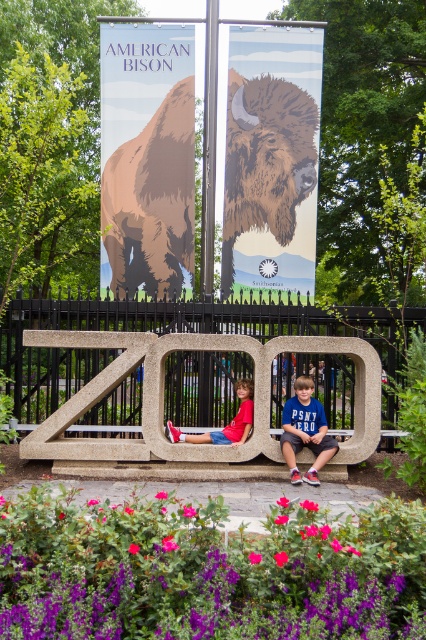
Who is more distant from viewer, (x=144, y=390) or (x=296, y=97)?

The point (x=296, y=97) is behind.

Between point (161, 394) and point (282, 188), which one is positioned in front?

Positioned in front is point (161, 394).

This screenshot has width=426, height=640. In order to click on granite bench at center in this screenshot , I will do pos(163,410).

Who is positioned more to the left, brown textured bison at center or blue cotton shirt at center?

From the viewer's perspective, brown textured bison at center appears more on the left side.

Does brown textured bison at center have a lesser height compared to blue cotton shirt at center?

No.

Locate an element on the screen. Image resolution: width=426 pixels, height=640 pixels. brown textured bison at center is located at coordinates (271, 160).

Where is `brown textured bison at center`? This screenshot has height=640, width=426. brown textured bison at center is located at coordinates (271, 160).

Does brown textured bison at center have a greater width compared to red cotton shirt at center?

Yes.

Where is `brown textured bison at center`? The image size is (426, 640). brown textured bison at center is located at coordinates (271, 160).

Looking at this image, measure the distance between point (262, 179) and camera.

Point (262, 179) and camera are 40.49 feet apart.

In order to click on brown textured bison at center in this screenshot , I will do `click(271, 160)`.